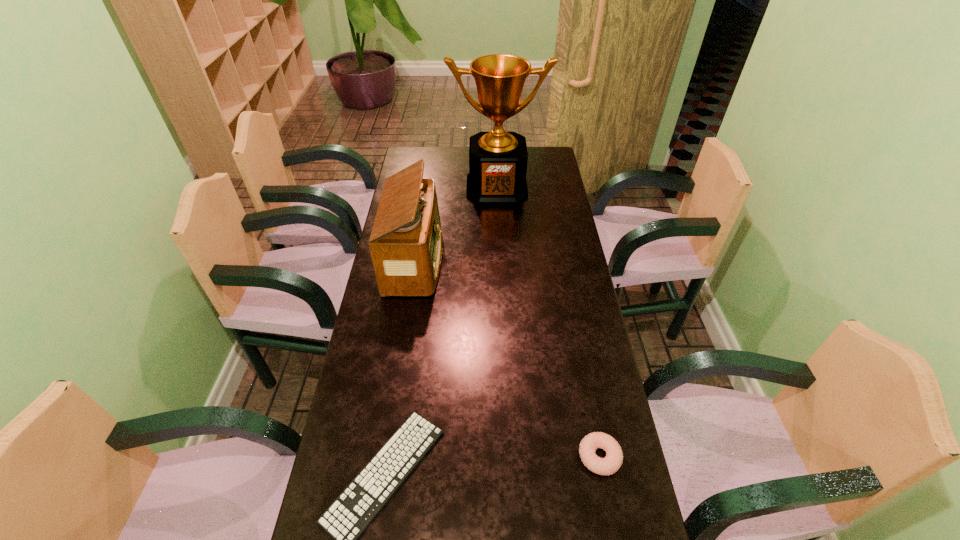
Locate an element on the screen. trophy cup present at the right edge is located at coordinates (498, 159).

At what (x,y) coordinates should I click in order to perform the action: click on doughnut at the right edge. Please return your answer as a coordinate pair (x, y). The width and height of the screenshot is (960, 540). Looking at the image, I should click on (612, 462).

This screenshot has height=540, width=960. Identify the location of object that is at the far right corner. (498, 159).

In the image, there is a desktop. At what (x,y) coordinates should I click in order to perform the action: click on blank space at the far edge. Please return your answer as a coordinate pair (x, y). The width and height of the screenshot is (960, 540). Looking at the image, I should click on (442, 149).

In order to click on vacant area at the left edge of the desktop in this screenshot , I will do `click(398, 350)`.

Locate an element on the screen. The height and width of the screenshot is (540, 960). free space at the right edge of the desktop is located at coordinates (603, 416).

Locate an element on the screen. vacant area at the far right corner of the desktop is located at coordinates (550, 152).

The image size is (960, 540). Find the location of `free space between the second farthest object and the doughnut`. free space between the second farthest object and the doughnut is located at coordinates (507, 359).

Locate an element on the screen. vacant area that lies between the radio receiver and the third tallest object is located at coordinates (507, 359).

Image resolution: width=960 pixels, height=540 pixels. Identify the location of blank region between the trophy cup and the second shortest object. (548, 322).